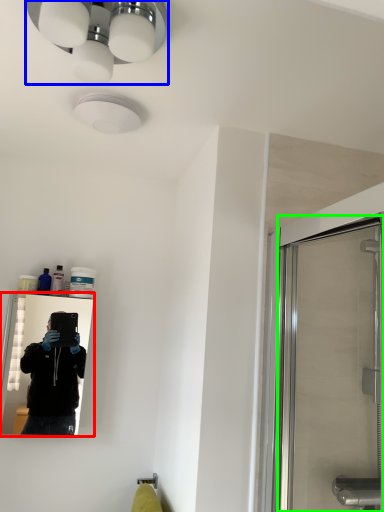
Question: Which object is positioned farthest from mirror (highlighted by a red box)? Select from light fixture (highlighted by a blue box) and screen door (highlighted by a green box).

Choices:
 (A) light fixture
 (B) screen door

Answer: (A)